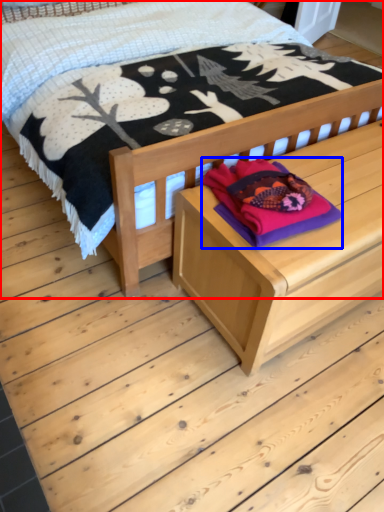
Question: Which object is further to the camera taking this photo, bed (highlighted by a red box) or clothing (highlighted by a blue box)?

Choices:
 (A) bed
 (B) clothing

Answer: (B)